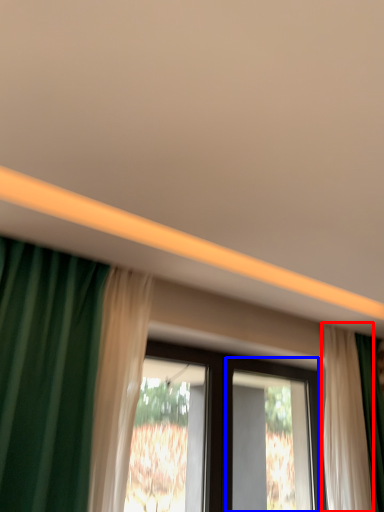
Question: Which of the following is the closest to the observer, curtain (highlighted by a red box) or screen door (highlighted by a blue box)?

Choices:
 (A) curtain
 (B) screen door

Answer: (B)